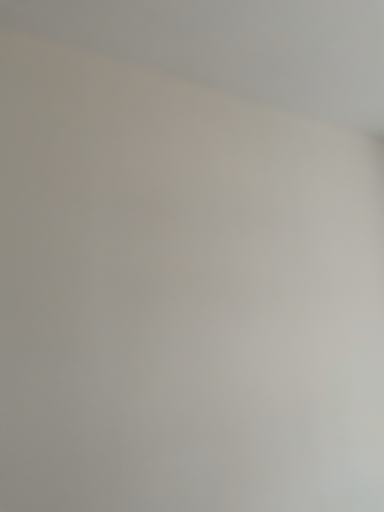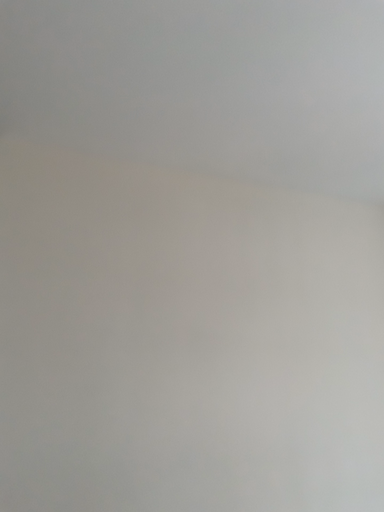
Question: How did the camera likely rotate when shooting the video?

Choices:
 (A) rotated right
 (B) rotated left

Answer: (B)